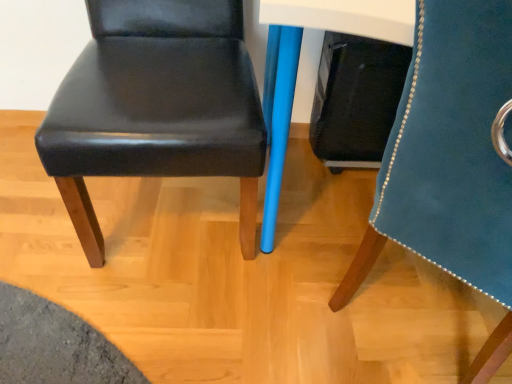
Question: From a real-world perspective, relative to velvet blue chair at right, the first chair viewed from the right, is black leather chair at center, placed as the 2th chair when sorted from right to left, vertically above or below?

Choices:
 (A) below
 (B) above

Answer: (A)

Question: Considering their positions, is black leather chair at center, placed as the 2th chair when sorted from right to left, located in front of or behind velvet blue chair at right, the first chair viewed from the right?

Choices:
 (A) front
 (B) behind

Answer: (B)

Question: Is point (197, 39) positioned closer to the camera than point (495, 168)?

Choices:
 (A) closer
 (B) farther

Answer: (B)

Question: Looking at their shapes, would you say velvet blue chair at right, the second chair when ordered from left to right, is wider or thinner than black leather chair at center, the 1th chair when ordered from left to right?

Choices:
 (A) wide
 (B) thin

Answer: (A)

Question: Is velvet blue chair at right, the first chair viewed from the right, bigger or smaller than black leather chair at center, the 1th chair when ordered from left to right?

Choices:
 (A) big
 (B) small

Answer: (A)

Question: From the image's perspective, is velvet blue chair at right, the first chair viewed from the right, above or below black leather chair at center, the 1th chair when ordered from left to right?

Choices:
 (A) above
 (B) below

Answer: (B)

Question: Is velvet blue chair at right, the first chair viewed from the right, inside the boundaries of black leather chair at center, placed as the 2th chair when sorted from right to left, or outside?

Choices:
 (A) outside
 (B) inside

Answer: (A)